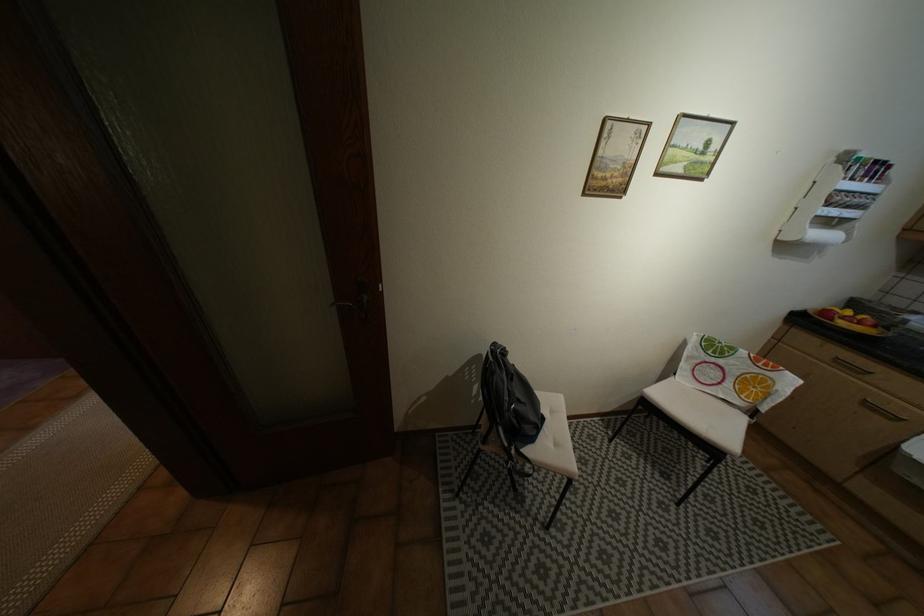
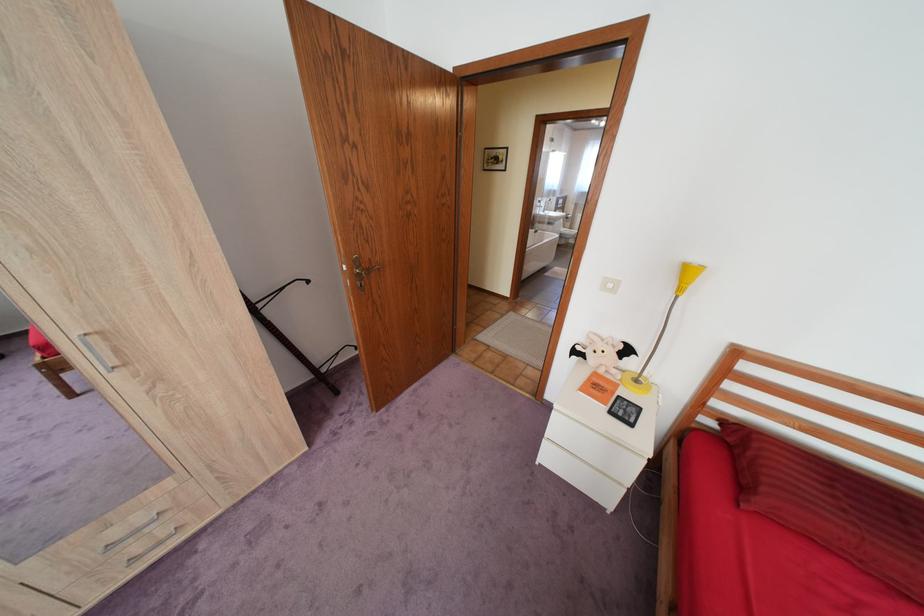
Question: I am providing you with two images of the same scene from different viewpoints. After the viewpoint changes to image2, which objects are now occluded?

Choices:
 (A) chair sitting surface
 (B) bat plush toy
 (C) white paper bag handle
 (D) white light switch

Answer: (A)